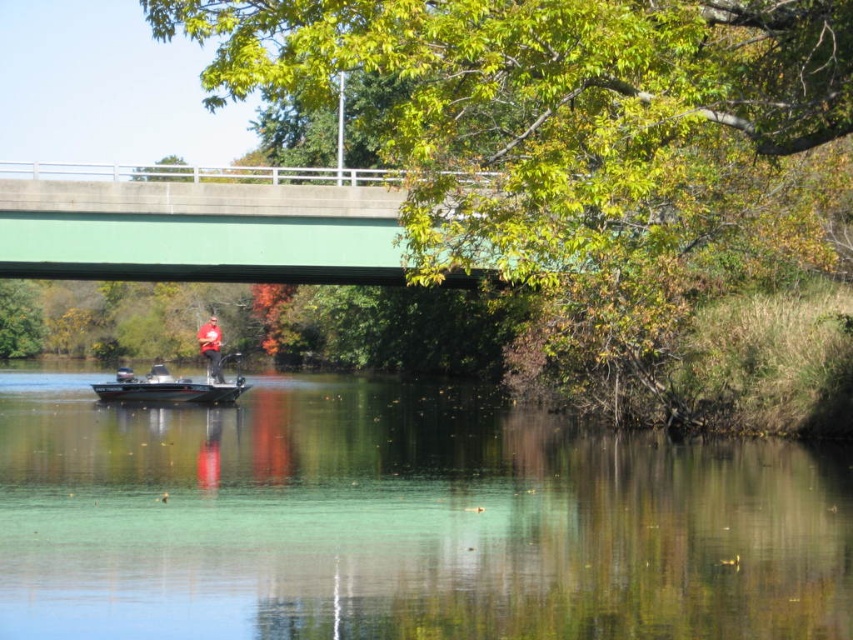
Does clear water at center appear over metallic gray boat at center?

Incorrect, clear water at center is not positioned above metallic gray boat at center.

Is the position of clear water at center less distant than that of metallic gray boat at center?

Yes, it is.

Between point (759, 548) and point (180, 392), which one is positioned behind?

The point (180, 392) is behind.

The image size is (853, 640). What are the coordinates of `clear water at center` in the screenshot? It's located at (402, 522).

Is point (103, 200) behind point (216, 369)?

No, it is not.

Between point (91, 227) and point (218, 330), which one is positioned in front?

Point (91, 227) is more forward.

Locate an element on the screen. This screenshot has height=640, width=853. green concrete bridge at upper center is located at coordinates (199, 224).

Is the position of green concrete bridge at upper center less distant than that of metallic gray boat at center?

That is True.

Who is more forward, (x=184, y=209) or (x=229, y=387)?

Positioned in front is point (x=184, y=209).

Is point (358, 276) closer to camera compared to point (155, 400)?

That is False.

The image size is (853, 640). Identify the location of green concrete bridge at upper center. (199, 224).